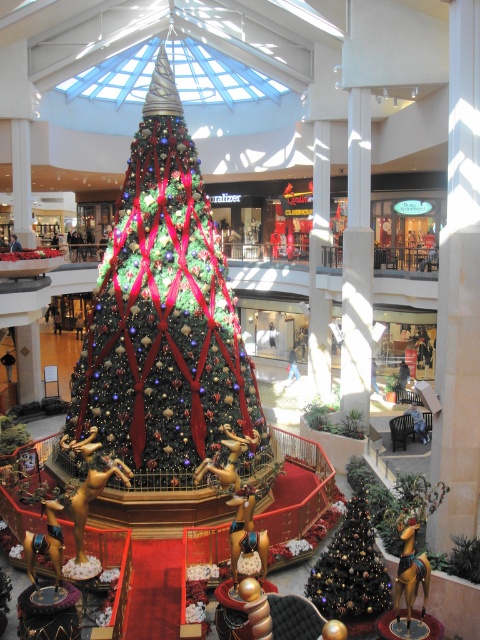
Does shiny green and red ribbons at center have a lesser width compared to shiny gold christmas tree at lower right?

In fact, shiny green and red ribbons at center might be wider than shiny gold christmas tree at lower right.

Is shiny green and red ribbons at center closer to camera compared to shiny gold christmas tree at lower right?

No, shiny green and red ribbons at center is further to the viewer.

Between point (123, 204) and point (355, 600), which one is positioned in front?

Point (355, 600)

Locate an element on the screen. The width and height of the screenshot is (480, 640). shiny green and red ribbons at center is located at coordinates (165, 317).